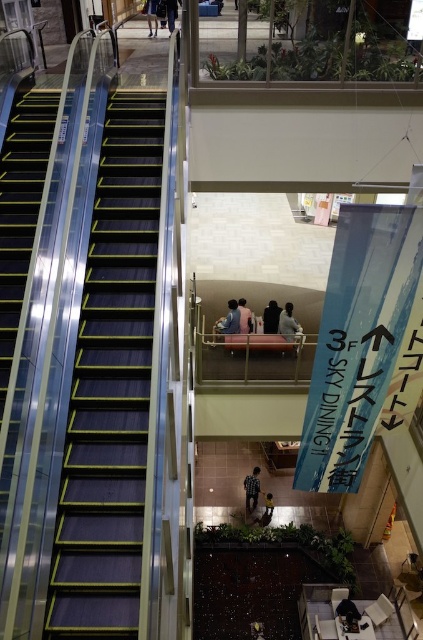
You are a customer in the shopping mall and you see the light pink fabric at center and the dark brown leather jacket at center. Which one is taller?

The light pink fabric at center is taller than the dark brown leather jacket at center.

You are observing a group of people in the shopping mall. You see a checkered shirt at center and a dark blue jeans at upper center. Which clothing item is located more to the right side?

The checkered shirt at center is positioned on the right side of dark blue jeans at upper center, so the checkered shirt at center is more to the right.